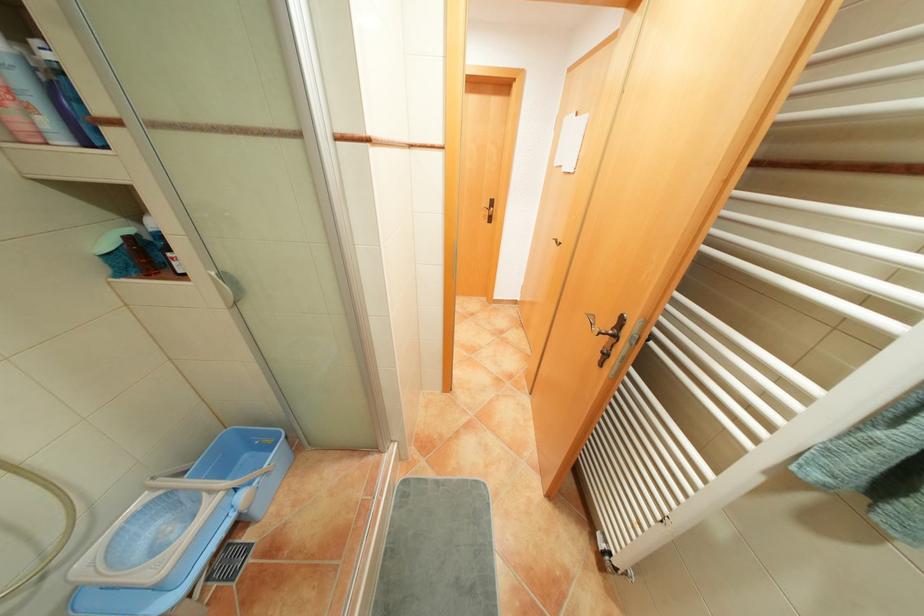
At what (x,y) coordinates should I click in order to perform the action: click on metal door handle. Please return your answer as a coordinate pair (x, y). Looking at the image, I should click on (608, 326).